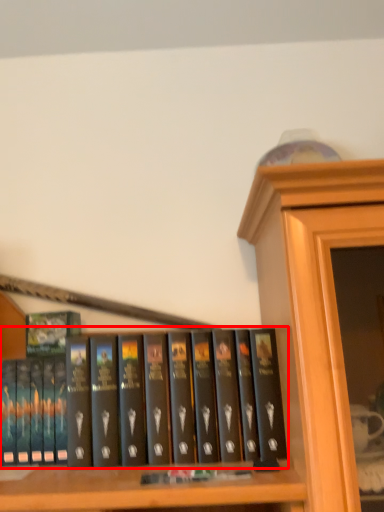
Question: In this image, where is book (annotated by the red box) located relative to book cover?

Choices:
 (A) right
 (B) left

Answer: (A)